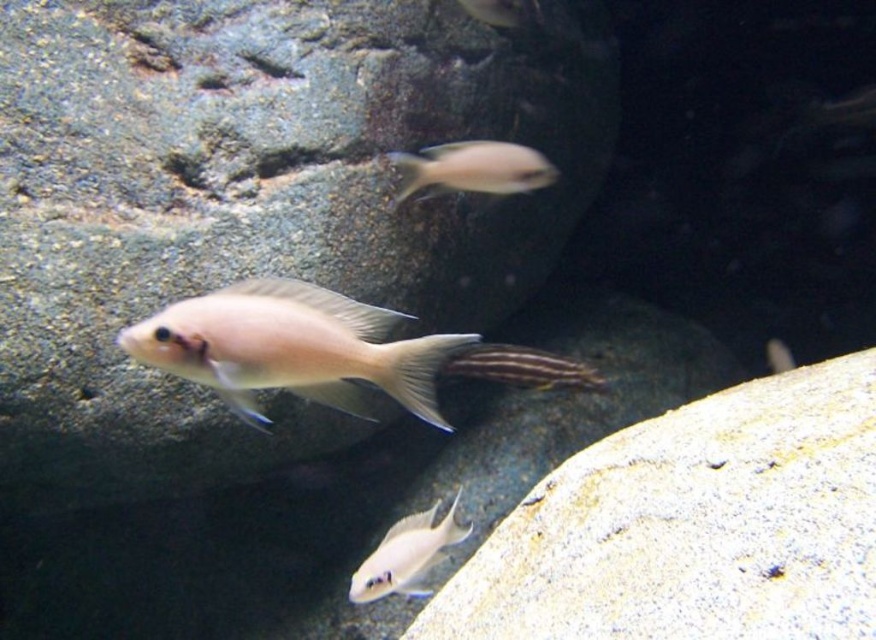
You are a scuba diver observing the underwater scene. You notice the white matte rock at lower right and the silvery metallic fish at upper center. Which object is positioned lower in the frame?

The white matte rock at lower right is positioned lower in the frame than the silvery metallic fish at upper center.

You are a marine biologist observing the underwater scene. You notice two fish at the upper center of the image. Which one has a wider body? The options are the matte white fish at upper center and the silvery metallic fish at upper center.

The matte white fish at upper center is wider than the silvery metallic fish at upper center according to the description provided.

What object is located at the coordinates point (x=521, y=368)?

The point (x=521, y=368) corresponds to the striped fin at center.